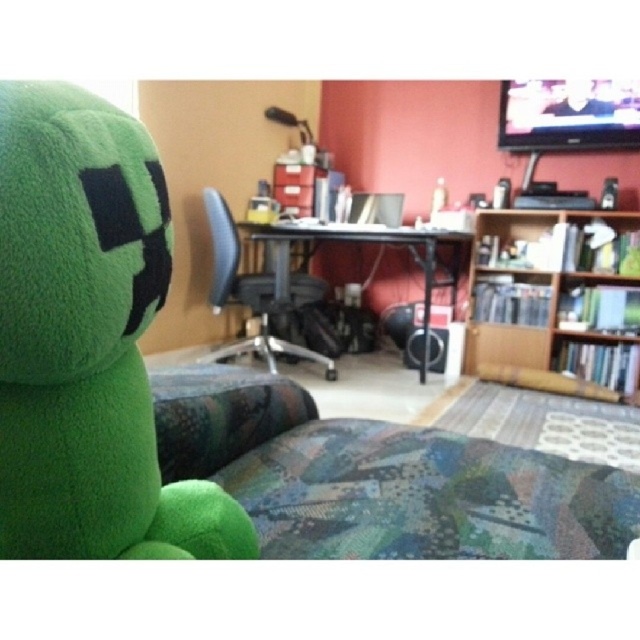
You are planning to move a large box that is 1.2 meters wide into this room. You need to place it between the black mesh office chair at center and the black plastic computer desk at center. Is there enough space between them for the box?

The black mesh office chair at center is narrower than the black plastic computer desk at center. However, the description only provides information about their widths relative to each other, not the actual distance between them. Therefore, it is impossible to determine if the 1.2 meter wide box will fit without knowing the exact spacing between the two objects.

You are organizing the desk area and need to move the green plush toy at left and the black mesh office chair at center. According to their positions, which object is closer to the right side of the desk?

The green plush toy at left is closer to the right side of the desk because it is positioned to the right of the black mesh office chair at center.